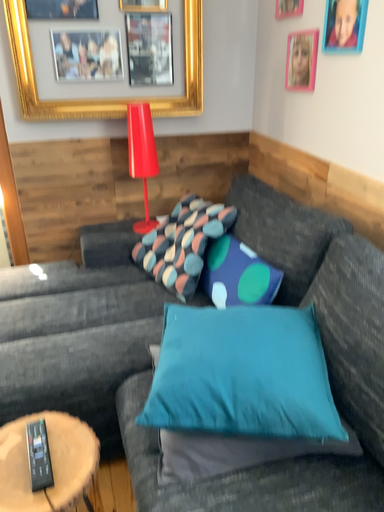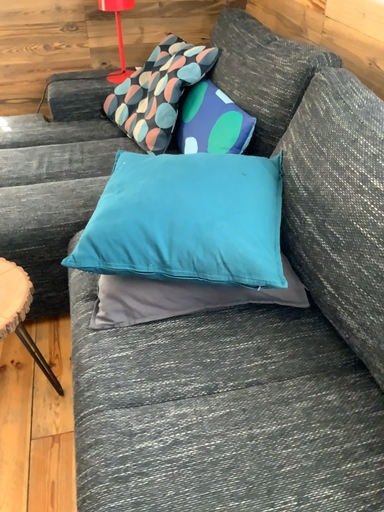
Question: Which way did the camera rotate in the video?

Choices:
 (A) rotated downward
 (B) rotated upward

Answer: (A)